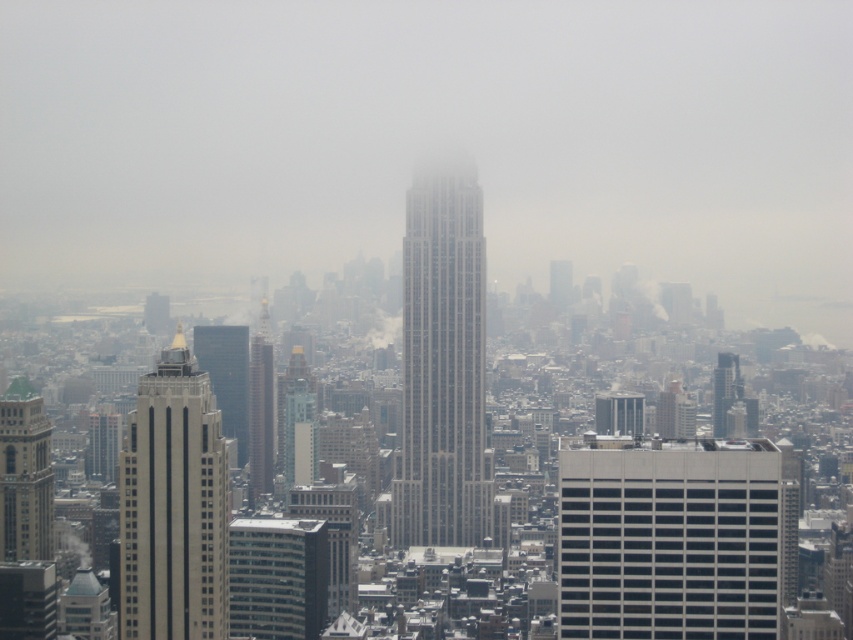
You are an architect evaluating the urban skyline. You observe the dark gray glass skyscraper at center and the smooth glass skyscraper at center. Which of these two buildings is taller?

The dark gray glass skyscraper at center is taller than the smooth glass skyscraper at center.

You are a city planner reviewing the urban layout. Given the coordinates provided for the dark gray glass skyscraper at center, how would you describe its position relative to the other buildings in the scene?

The dark gray glass skyscraper at center is positioned at coordinates point (x=260, y=417), which places it centrally within the midground among the dense cluster of buildings, making it a focal point in the urban skyline.

You are a city planner reviewing the urban layout. You notice the glassy reflective skyscraper at left and the gray glass skyscraper at center. Which one is positioned lower in the image?

The glassy reflective skyscraper at left is positioned lower than the gray glass skyscraper at center in the image.